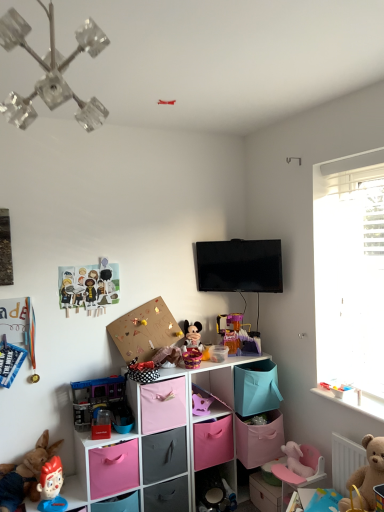
Question: In which direction should I rotate to look at pink fabric storage at lower center, the first shelf ordered from the bottom?

Choices:
 (A) left
 (B) right

Answer: (B)

Question: Is translucent plastic toy at lower right, marked as the 5th toy in a top-to-bottom arrangement, oriented towards purple plastic castle at center, the third toy in the top-to-bottom sequence?

Choices:
 (A) yes
 (B) no

Answer: (B)

Question: From the image's perspective, is translucent plastic toy at lower right, marked as the 5th toy in a top-to-bottom arrangement, below purple plastic castle at center, marked as the eighth toy in a bottom-to-top arrangement?

Choices:
 (A) yes
 (B) no

Answer: (A)

Question: Does translucent plastic toy at lower right, the 6th toy positioned from the bottom, come in front of purple plastic castle at center, the third toy in the top-to-bottom sequence?

Choices:
 (A) no
 (B) yes

Answer: (B)

Question: Is translucent plastic toy at lower right, marked as the 5th toy in a top-to-bottom arrangement, outside of purple plastic castle at center, the third toy in the top-to-bottom sequence?

Choices:
 (A) no
 (B) yes

Answer: (B)

Question: Can you confirm if translucent plastic toy at lower right, the 6th toy positioned from the bottom, is shorter than purple plastic castle at center, the third toy in the top-to-bottom sequence?

Choices:
 (A) yes
 (B) no

Answer: (A)

Question: Is purple plastic castle at center, marked as the eighth toy in a bottom-to-top arrangement, at the back of translucent plastic toy at lower right, marked as the 5th toy in a top-to-bottom arrangement?

Choices:
 (A) no
 (B) yes

Answer: (A)

Question: Considering the relative sizes of cardboard paper dolls at upper left, the 2th toy when ordered from top to bottom, and matte plastic figurine at lower left, placed as the tenth toy when sorted from top to bottom, in the image provided, is cardboard paper dolls at upper left, the 2th toy when ordered from top to bottom, smaller than matte plastic figurine at lower left, placed as the tenth toy when sorted from top to bottom,?

Choices:
 (A) yes
 (B) no

Answer: (A)

Question: Is cardboard paper dolls at upper left, the ninth toy positioned from the bottom, facing away from matte plastic figurine at lower left, placed as the tenth toy when sorted from top to bottom?

Choices:
 (A) no
 (B) yes

Answer: (A)

Question: Does cardboard paper dolls at upper left, the 2th toy when ordered from top to bottom, come in front of matte plastic figurine at lower left, placed as the tenth toy when sorted from top to bottom?

Choices:
 (A) yes
 (B) no

Answer: (B)

Question: From a real-world perspective, is cardboard paper dolls at upper left, the 2th toy when ordered from top to bottom, below matte plastic figurine at lower left, placed as the tenth toy when sorted from top to bottom?

Choices:
 (A) no
 (B) yes

Answer: (A)

Question: From a real-world perspective, is cardboard paper dolls at upper left, the ninth toy positioned from the bottom, physically above matte plastic figurine at lower left, the first toy from the bottom?

Choices:
 (A) no
 (B) yes

Answer: (B)

Question: From the image's perspective, is cardboard paper dolls at upper left, the 2th toy when ordered from top to bottom, beneath matte plastic figurine at lower left, placed as the tenth toy when sorted from top to bottom?

Choices:
 (A) yes
 (B) no

Answer: (B)

Question: Is pink fabric drawer at center, which is the second drawer from top to bottom, thinner than plastic toy figure at lower left, marked as the eighth toy in a top-to-bottom arrangement?

Choices:
 (A) no
 (B) yes

Answer: (A)